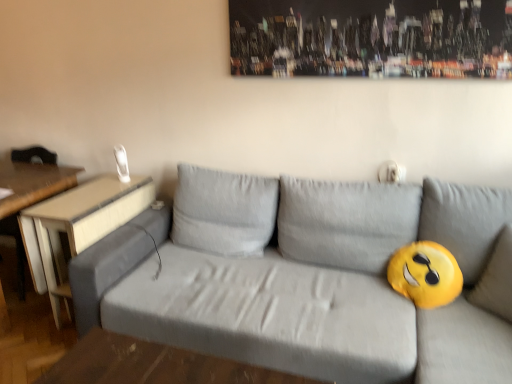
Question: Is light brown wood table at left, the first table when ordered from right to left, taller than gray fabric couch at center?

Choices:
 (A) no
 (B) yes

Answer: (A)

Question: Is light brown wood table at left, which is the 2th table in left-to-right order, smaller than gray fabric couch at center?

Choices:
 (A) no
 (B) yes

Answer: (B)

Question: Does light brown wood table at left, the first table when ordered from right to left, have a lesser width compared to gray fabric couch at center?

Choices:
 (A) no
 (B) yes

Answer: (B)

Question: Is light brown wood table at left, the first table when ordered from right to left, positioned with its back to gray fabric couch at center?

Choices:
 (A) no
 (B) yes

Answer: (A)

Question: Does light brown wood table at left, the first table when ordered from right to left, have a larger size compared to gray fabric couch at center?

Choices:
 (A) no
 (B) yes

Answer: (A)

Question: From the image's perspective, is light brown wood table at left, the first table when ordered from right to left, above gray fabric couch at center?

Choices:
 (A) yes
 (B) no

Answer: (A)

Question: Is wooden table at left, the 2th table in the right-to-left sequence, far from light brown wood table at left, which is the 2th table in left-to-right order?

Choices:
 (A) yes
 (B) no

Answer: (B)

Question: Is the depth of wooden table at left, the 1th table when ordered from left to right, less than that of light brown wood table at left, which is the 2th table in left-to-right order?

Choices:
 (A) yes
 (B) no

Answer: (B)

Question: Does wooden table at left, the 2th table in the right-to-left sequence, have a smaller size compared to light brown wood table at left, the first table when ordered from right to left?

Choices:
 (A) yes
 (B) no

Answer: (B)

Question: Does wooden table at left, the 2th table in the right-to-left sequence, lie behind light brown wood table at left, which is the 2th table in left-to-right order?

Choices:
 (A) yes
 (B) no

Answer: (A)

Question: Is wooden table at left, the 1th table when ordered from left to right, placed right next to light brown wood table at left, the first table when ordered from right to left?

Choices:
 (A) yes
 (B) no

Answer: (B)

Question: Would you say wooden table at left, the 1th table when ordered from left to right, is outside light brown wood table at left, the first table when ordered from right to left?

Choices:
 (A) yes
 (B) no

Answer: (A)

Question: Can you confirm if gray fabric couch at center is positioned to the right of wooden table at left, the 1th table when ordered from left to right?

Choices:
 (A) no
 (B) yes

Answer: (B)